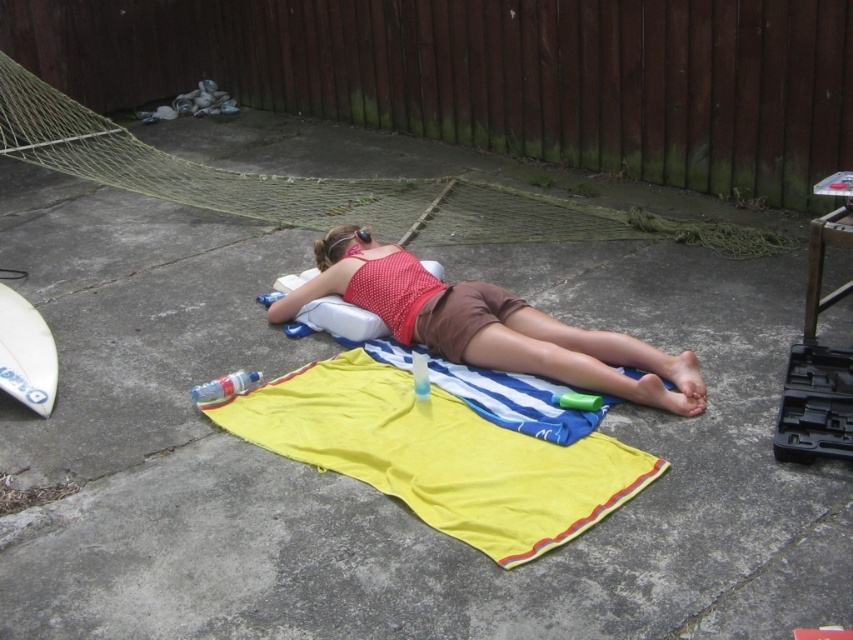
You are a photographer trying to capture the yellow fabric towel at center and the matte red tank top at center in the same frame. Based on their sizes, which object should you focus on to ensure both are fully visible in the photo?

The yellow fabric towel at center has a smaller width than the matte red tank top at center. To ensure both are fully visible, focus on the matte red tank top at center since it is wider, allowing the smaller yellow fabric towel at center to fit within the frame.

You are standing at point (44, 342) and want to walk to point (556, 380). Which direction should you move relative to the person lying on the concrete?

You should move forward relative to the person lying on the concrete because point (556, 380) is in front of point (44, 342).

Consider the image. You are a photographer taking a picture of the scene. You want to focus on the matte red tank top at center and the white matte surfboard at lower left. Which object should you adjust your camera focus on first if you want to ensure both are in focus?

The matte red tank top at center is closer to the viewer than the white matte surfboard at lower left. To ensure both are in focus, you should adjust the camera focus on the matte red tank top at center first, as it is closer, and then adjust for the surfboard further away.